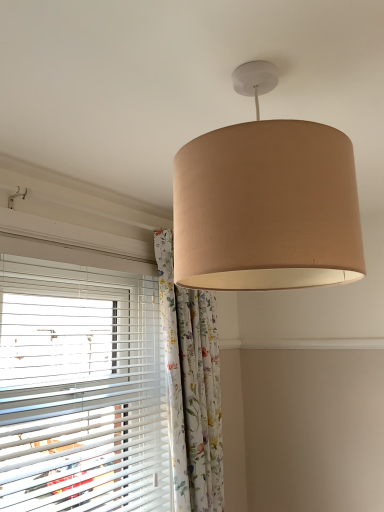
Question: Can you confirm if floral fabric curtain at center is positioned to the left of beige fabric lampshade at upper center?

Choices:
 (A) yes
 (B) no

Answer: (A)

Question: Is floral fabric curtain at center completely or partially outside of beige fabric lampshade at upper center?

Choices:
 (A) yes
 (B) no

Answer: (A)

Question: Is beige fabric lampshade at upper center inside floral fabric curtain at center?

Choices:
 (A) yes
 (B) no

Answer: (B)

Question: From the image's perspective, is floral fabric curtain at center above beige fabric lampshade at upper center?

Choices:
 (A) no
 (B) yes

Answer: (A)

Question: Does floral fabric curtain at center have a lesser width compared to beige fabric lampshade at upper center?

Choices:
 (A) yes
 (B) no

Answer: (A)

Question: Is floral fabric curtain at center wider than beige fabric lampshade at upper center?

Choices:
 (A) yes
 (B) no

Answer: (B)

Question: Is beige fabric lampshade at upper center facing towards white plastic blinds at left?

Choices:
 (A) no
 (B) yes

Answer: (A)

Question: Does beige fabric lampshade at upper center come in front of white plastic blinds at left?

Choices:
 (A) no
 (B) yes

Answer: (B)

Question: Is beige fabric lampshade at upper center outside white plastic blinds at left?

Choices:
 (A) no
 (B) yes

Answer: (B)

Question: Does beige fabric lampshade at upper center appear on the right side of white plastic blinds at left?

Choices:
 (A) yes
 (B) no

Answer: (A)

Question: Does beige fabric lampshade at upper center appear on the left side of white plastic blinds at left?

Choices:
 (A) yes
 (B) no

Answer: (B)

Question: Does beige fabric lampshade at upper center have a larger size compared to white plastic blinds at left?

Choices:
 (A) yes
 (B) no

Answer: (B)

Question: Is floral fabric curtain at center inside beige fabric lampshade at upper center?

Choices:
 (A) yes
 (B) no

Answer: (B)